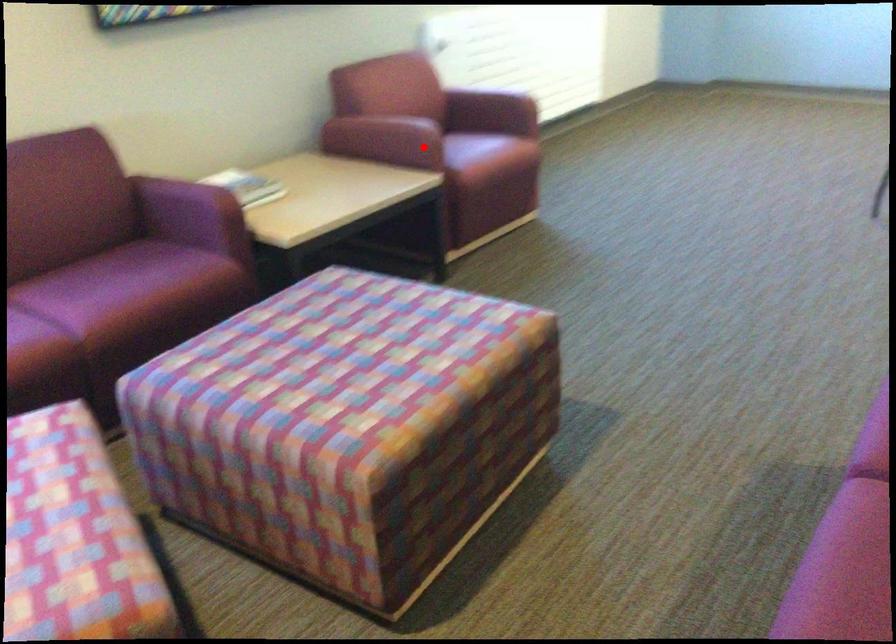
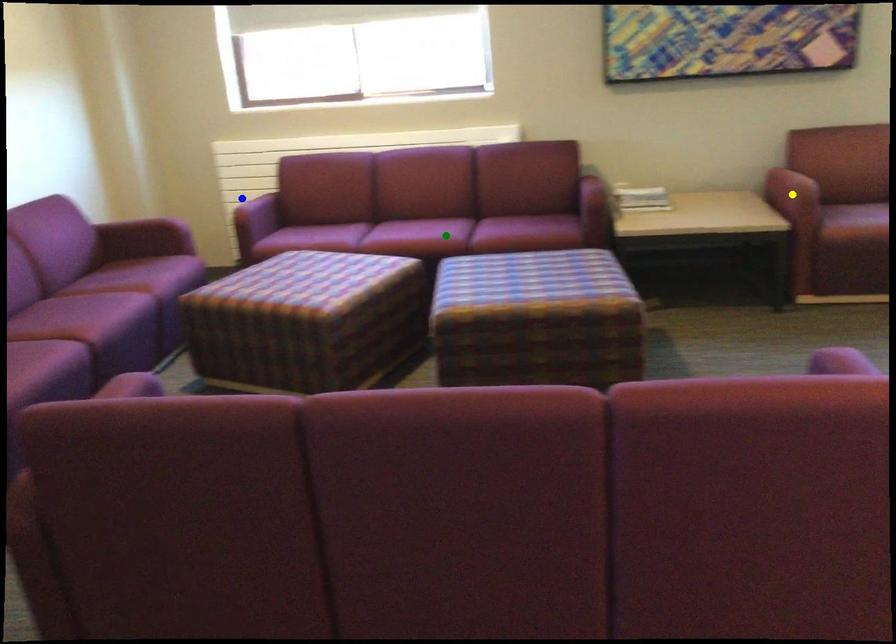
Question: I am providing you with two images of the same scene from different viewpoints. A red point is marked on the first image. You are given multiple points on the second image. In image 2, which mark is for the same physical point as the one in image 1?

Choices:
 (A) yellow point
 (B) blue point
 (C) green point

Answer: (A)